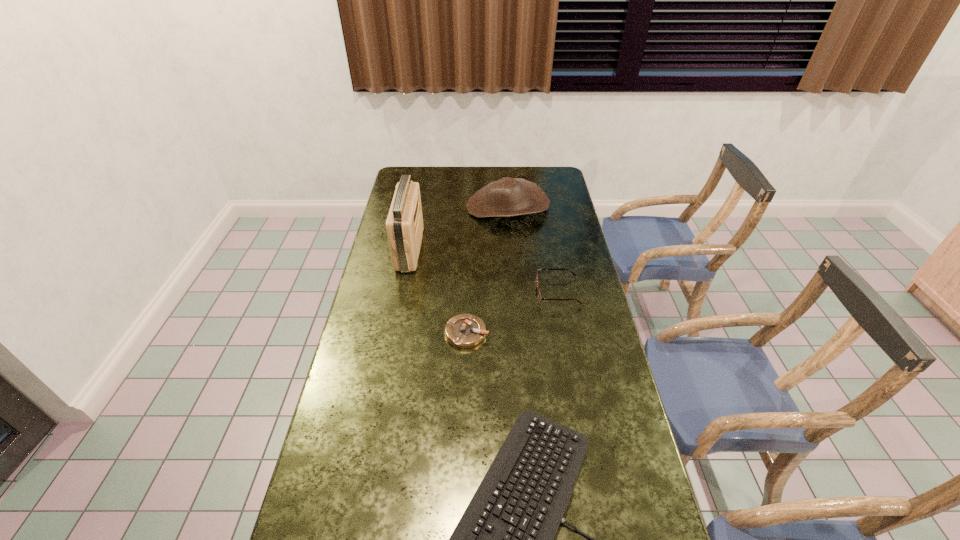
Find the location of `vacant space at the right edge of the desktop`. vacant space at the right edge of the desktop is located at coordinates (568, 367).

Where is `vacant space at the far right corner of the desktop`? The height and width of the screenshot is (540, 960). vacant space at the far right corner of the desktop is located at coordinates (550, 188).

Locate an element on the screen. The image size is (960, 540). vacant region between the second tallest object and the third farthest object is located at coordinates (533, 249).

The image size is (960, 540). What are the coordinates of `free space that is in between the fourth farthest object and the spectacles` in the screenshot? It's located at (513, 312).

What are the coordinates of `vacant space that is in between the ashtray and the leftmost object` in the screenshot? It's located at (439, 291).

The image size is (960, 540). I want to click on vacant region between the second shortest object and the fourth shortest object, so click(x=488, y=270).

Find the location of a particular element. This screenshot has height=540, width=960. vacant area that lies between the cowboy hat and the third tallest object is located at coordinates (533, 249).

This screenshot has width=960, height=540. Find the location of `free space between the ashtray and the radio receiver`. free space between the ashtray and the radio receiver is located at coordinates pyautogui.click(x=439, y=291).

Locate an element on the screen. This screenshot has height=540, width=960. object that stands as the second closest to the nearest object is located at coordinates (539, 296).

Where is `object that is the closest to the third nearest object`? Image resolution: width=960 pixels, height=540 pixels. object that is the closest to the third nearest object is located at coordinates (464, 330).